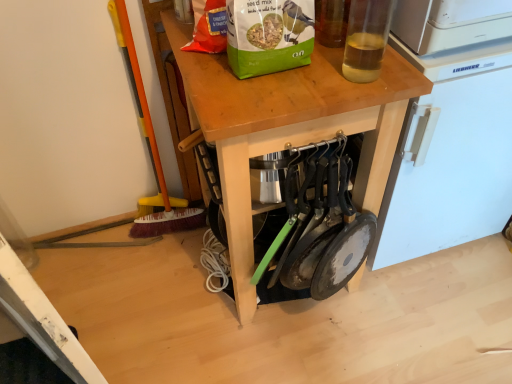
The height and width of the screenshot is (384, 512). I want to click on vacant space in front of green matte paper bag at upper center, so click(x=270, y=99).